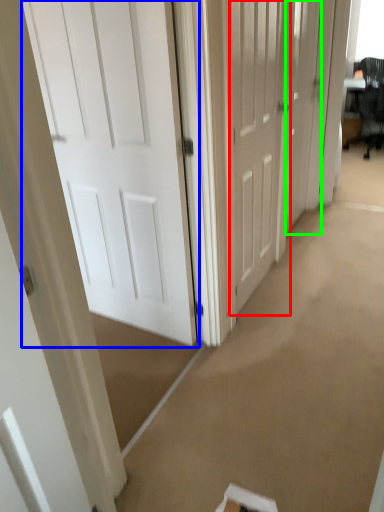
Question: Considering the real-world distances, which object is farthest from door (highlighted by a red box)? door (highlighted by a blue box) or door (highlighted by a green box)?

Choices:
 (A) door
 (B) door

Answer: (A)